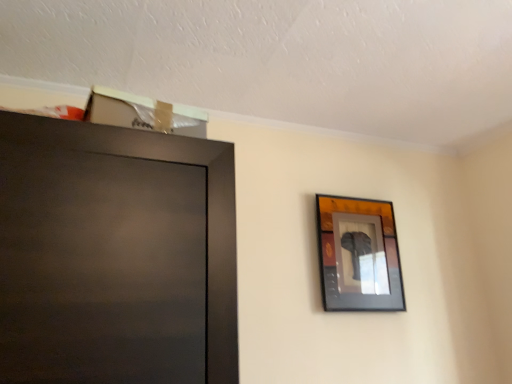
Describe the element at coordinates (359, 255) in the screenshot. The height and width of the screenshot is (384, 512). I see `matte black picture frame at upper right` at that location.

What is the approximate height of matte black picture frame at upper right?

21.92 inches.

Find the location of a particular element. matte black picture frame at upper right is located at coordinates (359, 255).

Locate an element on the screen. The image size is (512, 384). matte black picture frame at upper right is located at coordinates (359, 255).